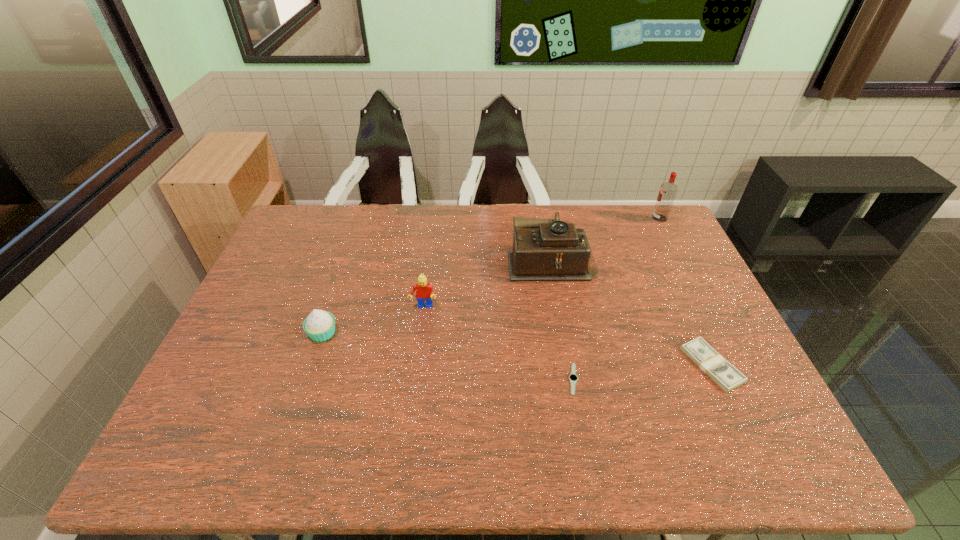
Identify the location of free spot between the leftmost object and the watch. (448, 356).

Image resolution: width=960 pixels, height=540 pixels. Find the location of `unoccupied area between the watch and the tallest object`. unoccupied area between the watch and the tallest object is located at coordinates (616, 299).

Identify which object is the fourth closest to the fifth nearest object. Please provide its 2D coordinates. Your answer should be formatted as a tuple, i.e. [(x, y)], where the tuple contains the x and y coordinates of a point satisfying the conditions above.

[(573, 378)]

Identify which object is the fifth nearest to the fourth tallest object. Please provide its 2D coordinates. Your answer should be formatted as a tuple, i.e. [(x, y)], where the tuple contains the x and y coordinates of a point satisfying the conditions above.

[(668, 190)]

The width and height of the screenshot is (960, 540). I want to click on vacant region that satisfies the following two spatial constraints: 1. on the front-facing side of the second object from left to right; 2. on the left side of the watch, so click(414, 379).

Find the location of a particular element. free space in the image that satisfies the following two spatial constraints: 1. on the front-facing side of the shortest object; 2. on the right side of the fifth object from right to left is located at coordinates (414, 379).

This screenshot has height=540, width=960. I want to click on vacant region that satisfies the following two spatial constraints: 1. on the horn of the second shortest object; 2. on the right side of the second tallest object, so click(x=569, y=365).

The width and height of the screenshot is (960, 540). I want to click on free location that satisfies the following two spatial constraints: 1. on the horn of the phonograph_record; 2. on the front-facing side of the Lego, so click(559, 307).

The height and width of the screenshot is (540, 960). I want to click on vacant region that satisfies the following two spatial constraints: 1. on the horn of the phonograph_record; 2. on the back side of the dollar, so coord(569,365).

In order to click on free region that satisfies the following two spatial constraints: 1. on the horn of the second farthest object; 2. on the left side of the watch in this screenshot , I will do `click(571, 379)`.